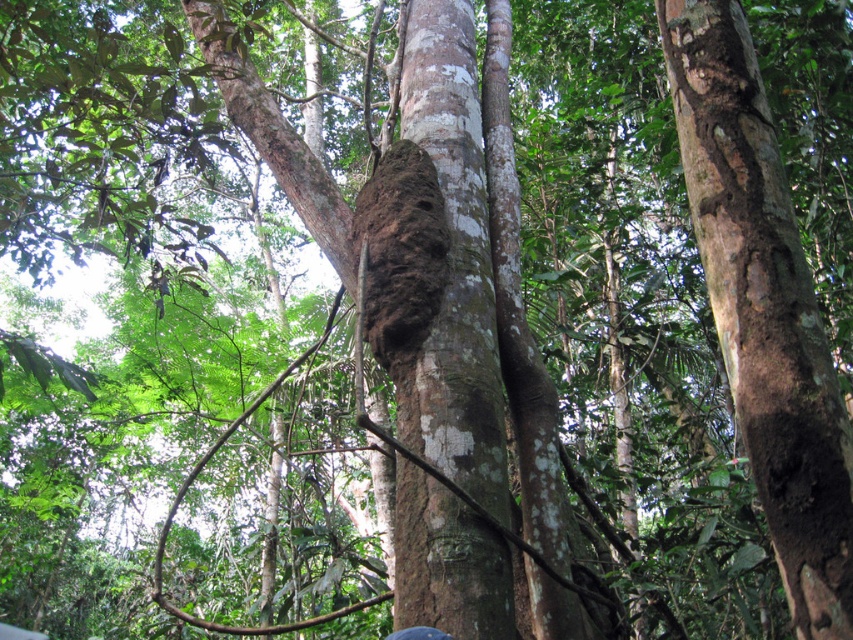
Does brown rough bark at center have a greater width compared to brown rough bark tree trunk at center?

No, brown rough bark at center is not wider than brown rough bark tree trunk at center.

Can you confirm if brown rough bark at center is positioned to the left of brown rough bark tree trunk at center?

No, brown rough bark at center is not to the left of brown rough bark tree trunk at center.

Does point (770, 477) lie in front of point (405, 554)?

Yes.

Identify the location of brown rough bark at center. The image size is (853, 640). pyautogui.click(x=763, y=307).